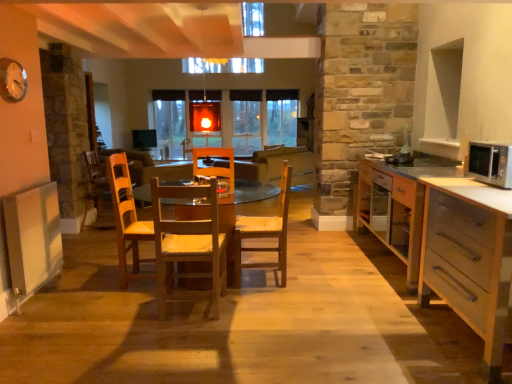
Question: Is white glossy clock at upper left bigger or smaller than wooden chair at center, which appears as the 1th chair when viewed from the back?

Choices:
 (A) big
 (B) small

Answer: (B)

Question: Choose the correct answer: Is white glossy clock at upper left inside wooden chair at center, marked as the 2th chair in a front-to-back arrangement, or outside it?

Choices:
 (A) outside
 (B) inside

Answer: (A)

Question: Estimate the real-world distances between objects in this image. Which object is closer to the wooden table at center?

Choices:
 (A) light brown wood cabinet at right, which appears as the first cabinetry when viewed from the back
 (B) wooden chair at center, positioned as the first chair in right-to-left order
 (C) wooden chair at center, which is the first chair from front to back
 (D) wooden armchair at left
 (E) white wood drawer at lower right, the first cabinetry when ordered from front to back

Answer: (B)

Question: Which object is positioned closest to the wooden chair at center?

Choices:
 (A) light brown wood cabinet at right, which appears as the first cabinetry when viewed from the back
 (B) silver metallic microwave at right
 (C) wooden armchair at left
 (D) white glossy clock at upper left
 (E) wooden chair at center, marked as the 2th chair in a front-to-back arrangement

Answer: (A)